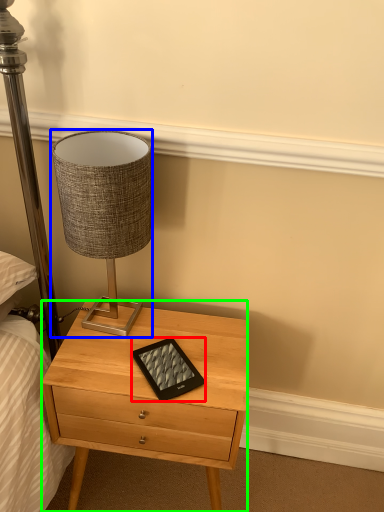
Question: Based on their relative distances, which object is nearer to tablet computer (highlighted by a red box)? Choose from lamp (highlighted by a blue box) and nightstand (highlighted by a green box).

Choices:
 (A) lamp
 (B) nightstand

Answer: (B)